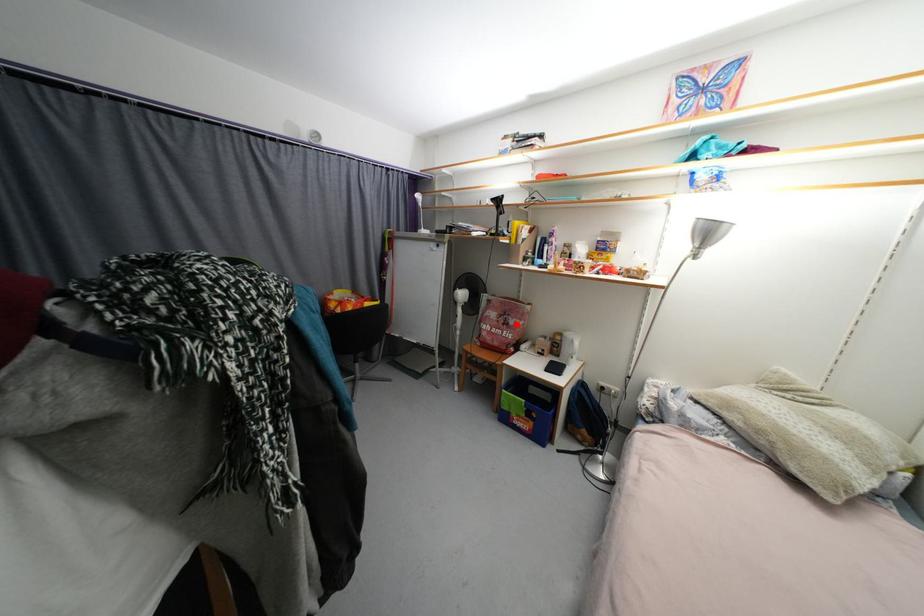
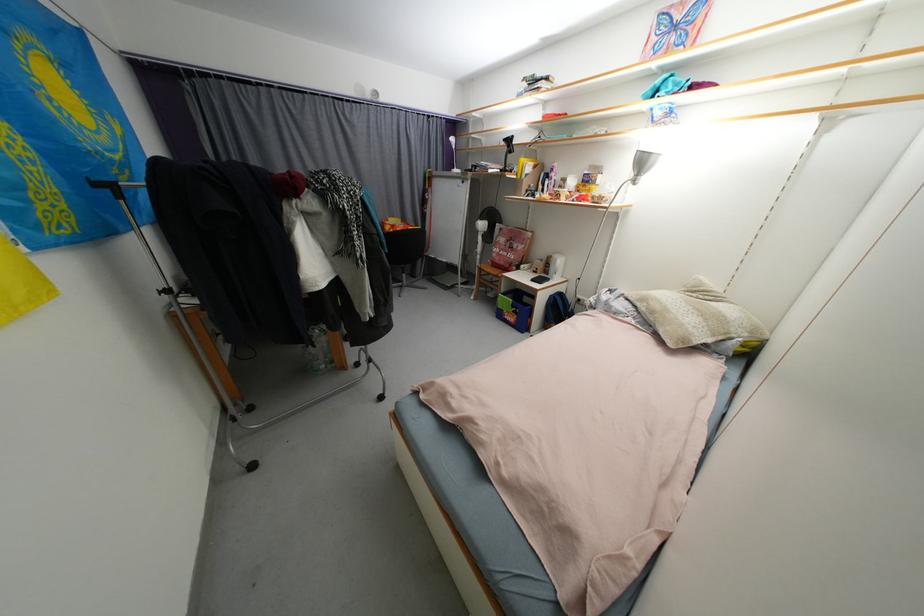
In the second image, find the point that corresponds to the highlighted location in the first image.

(520, 248)